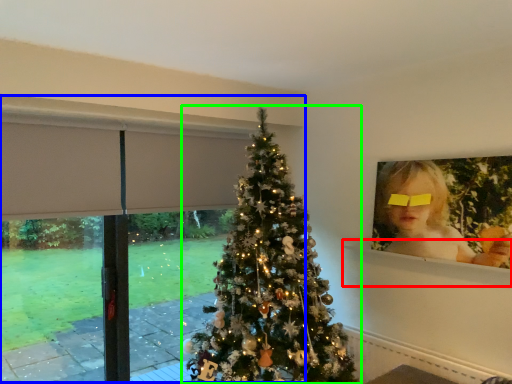
Question: Which object is positioned farthest from window sill (highlighted by a red box)? Select from window frame (highlighted by a blue box) and christmas tree (highlighted by a green box).

Choices:
 (A) window frame
 (B) christmas tree

Answer: (A)